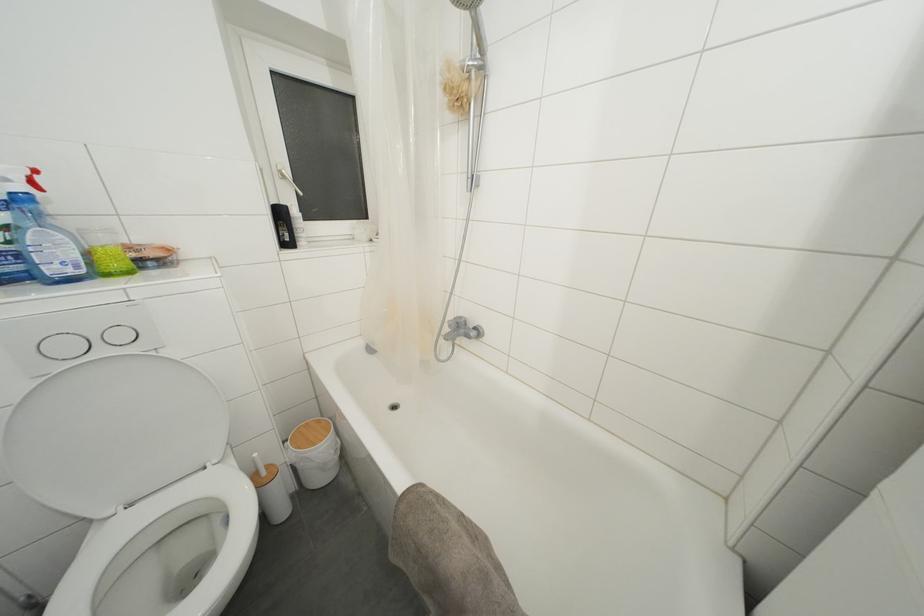
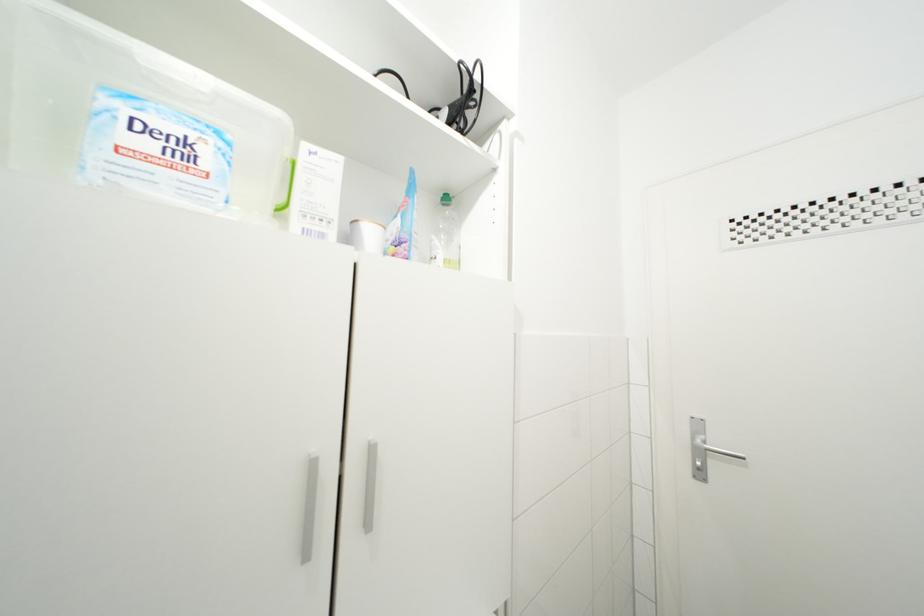
Question: The images are taken continuously from a first-person perspective. In which direction is your viewpoint rotating?

Choices:
 (A) Left
 (B) Right
 (C) Up
 (D) Down

Answer: (B)